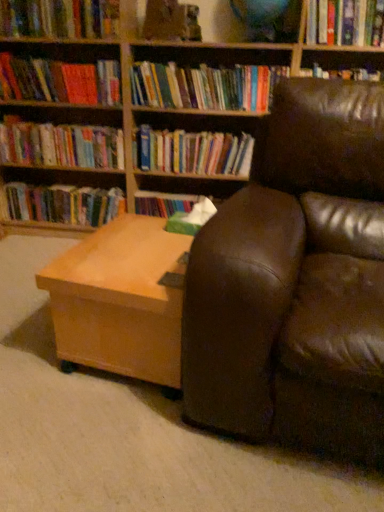
In order to face hardcover books at center, which is counted as the second book, starting from the bottom, should I rotate leftwards or rightwards?

You should look right and rotate roughly 0.440 degrees.

The height and width of the screenshot is (512, 384). Find the location of `hardcover books at center, which is counted as the second book, starting from the bottom`. hardcover books at center, which is counted as the second book, starting from the bottom is located at coordinates (194, 152).

What do you see at coordinates (61, 145) in the screenshot? I see `hardcover books at left, which is the 6th book from top to bottom` at bounding box center [61, 145].

What do you see at coordinates (205, 87) in the screenshot?
I see `hardcover book at upper center, which is counted as the fourth book, starting from the bottom` at bounding box center [205, 87].

Describe the element at coordinates (121, 300) in the screenshot. The image size is (384, 512). I see `light brown wood table at lower left` at that location.

How much space does hardcover books at left, which appears as the 8th book when viewed from the top, occupy horizontally?

7.59 inches.

Find the location of `hardcover books at center, arranged as the seventh book when viewed from the top`. hardcover books at center, arranged as the seventh book when viewed from the top is located at coordinates (194, 152).

Would you say hardcover book at upper left, which appears as the 8th book when ordered from the bottom, is to the left or to the right of hardcover book at upper right, which appears as the fifth book when ordered from the bottom, in the picture?

Clearly, hardcover book at upper left, which appears as the 8th book when ordered from the bottom, is on the left of hardcover book at upper right, which appears as the fifth book when ordered from the bottom, in the image.

In the scene shown: Considering the sizes of objects hardcover book at upper left, which is the first book in top-to-bottom order, and hardcover book at upper right, the 4th book positioned from the top, in the image provided, who is smaller, hardcover book at upper left, which is the first book in top-to-bottom order, or hardcover book at upper right, the 4th book positioned from the top,?

Smaller between the two is hardcover book at upper right, the 4th book positioned from the top.

Which of these two, hardcover book at upper left, which appears as the 8th book when ordered from the bottom, or hardcover book at upper right, which appears as the fifth book when ordered from the bottom, stands taller?

hardcover book at upper left, which appears as the 8th book when ordered from the bottom.

Is point (35, 33) in front of point (320, 68)?

Yes, it is.

How distant is hardcover book at upper right, arranged as the 2th book when viewed from the top, from hardcover books at left, which is the 6th book from top to bottom?

hardcover book at upper right, arranged as the 2th book when viewed from the top, and hardcover books at left, which is the 6th book from top to bottom, are 1.25 meters apart from each other.

Is point (314, 42) more distant than point (85, 154)?

No, it is not.

How many degrees apart are the facing directions of hardcover book at upper right, which is the 7th book in bottom-to-top order, and hardcover books at left, which is the 6th book from top to bottom?

0.000523 degrees separate the facing orientations of hardcover book at upper right, which is the 7th book in bottom-to-top order, and hardcover books at left, which is the 6th book from top to bottom.

Would you say hardcover book at upper right, arranged as the 2th book when viewed from the top, contains hardcover books at left, which is the 6th book from top to bottom?

That's incorrect, hardcover books at left, which is the 6th book from top to bottom, is not inside hardcover book at upper right, arranged as the 2th book when viewed from the top.

Measure the distance between hardcover book at upper left, arranged as the sixth book when ordered from the bottom, and hardcover books at center, arranged as the seventh book when viewed from the top.

The distance of hardcover book at upper left, arranged as the sixth book when ordered from the bottom, from hardcover books at center, arranged as the seventh book when viewed from the top, is 17.94 inches.

Is hardcover book at upper left, arranged as the sixth book when ordered from the bottom, closer to camera compared to hardcover books at center, arranged as the seventh book when viewed from the top?

Yes, hardcover book at upper left, arranged as the sixth book when ordered from the bottom, is closer to the camera.

From the image's perspective, which object appears higher, hardcover book at upper left, arranged as the 3th book when viewed from the top, or hardcover books at center, which is counted as the second book, starting from the bottom?

hardcover book at upper left, arranged as the 3th book when viewed from the top, appears higher in the image.

Which of these two, hardcover book at upper left, arranged as the 3th book when viewed from the top, or hardcover books at center, arranged as the seventh book when viewed from the top, is wider?

hardcover book at upper left, arranged as the 3th book when viewed from the top, is wider.

Is hardcover book at upper center, arranged as the fifth book when viewed from the top, inside hardcover book at upper right, which is the 7th book in bottom-to-top order?

No, hardcover book at upper center, arranged as the fifth book when viewed from the top, is located outside of hardcover book at upper right, which is the 7th book in bottom-to-top order.

Would you say hardcover book at upper right, arranged as the 2th book when viewed from the top, is a long distance from hardcover book at upper center, arranged as the fifth book when viewed from the top?

Actually, hardcover book at upper right, arranged as the 2th book when viewed from the top, and hardcover book at upper center, arranged as the fifth book when viewed from the top, are a little close together.

There is a hardcover book at upper center, which is counted as the fourth book, starting from the bottom. Find the location of `the 4th book above it (from a real-world perspective)`. the 4th book above it (from a real-world perspective) is located at coordinates (345, 22).

Is hardcover book at upper right, arranged as the 2th book when viewed from the top, inside the boundaries of hardcover book at upper right, which appears as the fifth book when ordered from the bottom, or outside?

hardcover book at upper right, arranged as the 2th book when viewed from the top, is located beyond the bounds of hardcover book at upper right, which appears as the fifth book when ordered from the bottom.

Which of these two, hardcover book at upper right, which is the 7th book in bottom-to-top order, or hardcover book at upper right, the 4th book positioned from the top, is wider?

Wider between the two is hardcover book at upper right, the 4th book positioned from the top.

Which of these two, hardcover book at upper right, arranged as the 2th book when viewed from the top, or hardcover book at upper right, which appears as the fifth book when ordered from the bottom, is smaller?

hardcover book at upper right, which appears as the fifth book when ordered from the bottom, is smaller.

How distant is hardcover book at upper right, which is the 7th book in bottom-to-top order, from hardcover book at upper right, the 4th book positioned from the top?

hardcover book at upper right, which is the 7th book in bottom-to-top order, and hardcover book at upper right, the 4th book positioned from the top, are 22.86 centimeters apart.

From the image's perspective, between hardcover book at upper center, which is counted as the fourth book, starting from the bottom, and hardcover book at upper left, which is the first book in top-to-bottom order, which one is located above?

hardcover book at upper left, which is the first book in top-to-bottom order, from the image's perspective.

From a real-world perspective, which object stands above the other?

hardcover book at upper left, which is the first book in top-to-bottom order.

This screenshot has height=512, width=384. Identify the location of the 1st book behind when counting from the hardcover book at upper left, which appears as the 8th book when ordered from the bottom. (205, 87).

Can you confirm if hardcover book at upper center, which is counted as the fourth book, starting from the bottom, is shorter than hardcover book at upper left, which appears as the 8th book when ordered from the bottom?

In fact, hardcover book at upper center, which is counted as the fourth book, starting from the bottom, may be taller than hardcover book at upper left, which appears as the 8th book when ordered from the bottom.

Is point (118, 76) farther from viewer compared to point (17, 197)?

No, it is not.

Is hardcover book at upper left, arranged as the sixth book when ordered from the bottom, completely or partially outside of hardcover books at left, the first book ordered from the bottom?

Yes, hardcover book at upper left, arranged as the sixth book when ordered from the bottom, is outside of hardcover books at left, the first book ordered from the bottom.

From the image's perspective, which one is positioned higher, hardcover book at upper left, arranged as the 3th book when viewed from the top, or hardcover books at left, which appears as the 8th book when viewed from the top?

hardcover book at upper left, arranged as the 3th book when viewed from the top, appears higher in the image.

Can you tell me how much hardcover book at upper left, arranged as the 3th book when viewed from the top, and hardcover books at left, which appears as the 8th book when viewed from the top, differ in facing direction?

There is a 0.000569-degree angle between the facing directions of hardcover book at upper left, arranged as the 3th book when viewed from the top, and hardcover books at left, which appears as the 8th book when viewed from the top.

At what (x,y) coordinates should I click in order to perform the action: click on the 4th book counting from the left side of the hardcover book at upper right, which appears as the fifth book when ordered from the bottom. Please return your answer as a coordinate pair (x, y). The width and height of the screenshot is (384, 512). Looking at the image, I should click on (x=59, y=18).

From a real-world perspective, count 5th books downward from the hardcover book at upper right, arranged as the 2th book when viewed from the top, and point to it. Please provide its 2D coordinates.

[(61, 145)]

From the image, which object appears to be nearer to brown leather couch at right, light brown wood table at lower left or hardcover book at upper left, which appears as the 8th book when ordered from the bottom?

light brown wood table at lower left lies closer to brown leather couch at right than the other object.

Which object lies further to the anchor point hardcover book at upper right, which appears as the fifth book when ordered from the bottom, brown leather couch at right or hardcover book at upper right, arranged as the 2th book when viewed from the top?

The object further to hardcover book at upper right, which appears as the fifth book when ordered from the bottom, is brown leather couch at right.

Looking at the image, which one is located further to brown leather couch at right, hardcover book at upper right, arranged as the 2th book when viewed from the top, or hardcover books at center, which is counted as the second book, starting from the bottom?

Among the two, hardcover book at upper right, arranged as the 2th book when viewed from the top, is located further to brown leather couch at right.

Which object lies nearer to the anchor point hardcover books at left, which appears as the 8th book when viewed from the top, hardcover books at left, which appears as the 3th book when ordered from the bottom, or hardcover book at upper right, the 4th book positioned from the top?

hardcover books at left, which appears as the 3th book when ordered from the bottom, lies closer to hardcover books at left, which appears as the 8th book when viewed from the top, than the other object.

Based on their spatial positions, is hardcover books at left, which appears as the 8th book when viewed from the top, or hardcover book at upper right, which appears as the fifth book when ordered from the bottom, further from hardcover books at left, which appears as the 3th book when ordered from the bottom?

Based on the image, hardcover book at upper right, which appears as the fifth book when ordered from the bottom, appears to be further to hardcover books at left, which appears as the 3th book when ordered from the bottom.

From the image, which object appears to be farther from hardcover book at upper center, arranged as the fifth book when viewed from the top, hardcover book at upper left, which appears as the 8th book when ordered from the bottom, or hardcover book at upper left, arranged as the sixth book when ordered from the bottom?

hardcover book at upper left, which appears as the 8th book when ordered from the bottom, is positioned further to the anchor hardcover book at upper center, arranged as the fifth book when viewed from the top.

Based on their spatial positions, is hardcover book at upper left, which appears as the 8th book when ordered from the bottom, or hardcover book at upper center, arranged as the fifth book when viewed from the top, closer to light brown wood table at lower left?

hardcover book at upper center, arranged as the fifth book when viewed from the top, lies closer to light brown wood table at lower left than the other object.

From the image, which object appears to be farther from brown leather couch at right, hardcover books at center, arranged as the seventh book when viewed from the top, or hardcover book at upper right, which is the 7th book in bottom-to-top order?

Based on the image, hardcover book at upper right, which is the 7th book in bottom-to-top order, appears to be further to brown leather couch at right.

Find the location of `book located between hardcover books at center, arranged as the seventh book when viewed from the top, and hardcover book at upper right, arranged as the 2th book when viewed from the top, in the left-right direction`. book located between hardcover books at center, arranged as the seventh book when viewed from the top, and hardcover book at upper right, arranged as the 2th book when viewed from the top, in the left-right direction is located at coordinates (205, 87).

Locate an element on the screen. studio couch located between hardcover book at upper left, which appears as the 8th book when ordered from the bottom, and hardcover book at upper right, arranged as the 2th book when viewed from the top, in the left-right direction is located at coordinates (296, 281).

Locate an element on the screen. This screenshot has height=512, width=384. table between hardcover books at left, which appears as the 8th book when viewed from the top, and hardcover book at upper right, which is the 7th book in bottom-to-top order is located at coordinates (121, 300).

Identify the location of table positioned between brown leather couch at right and hardcover book at upper center, which is counted as the fourth book, starting from the bottom, from near to far. The height and width of the screenshot is (512, 384). (121, 300).